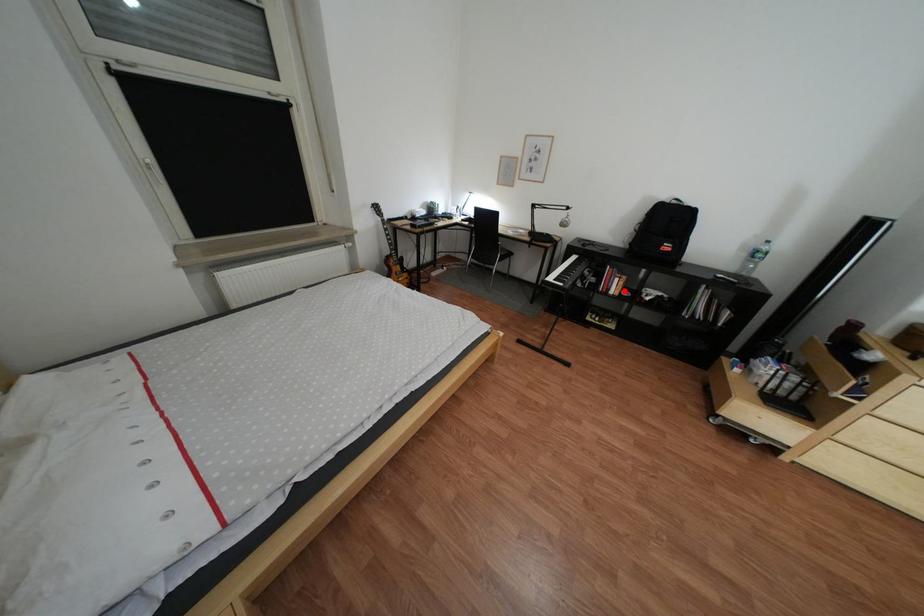
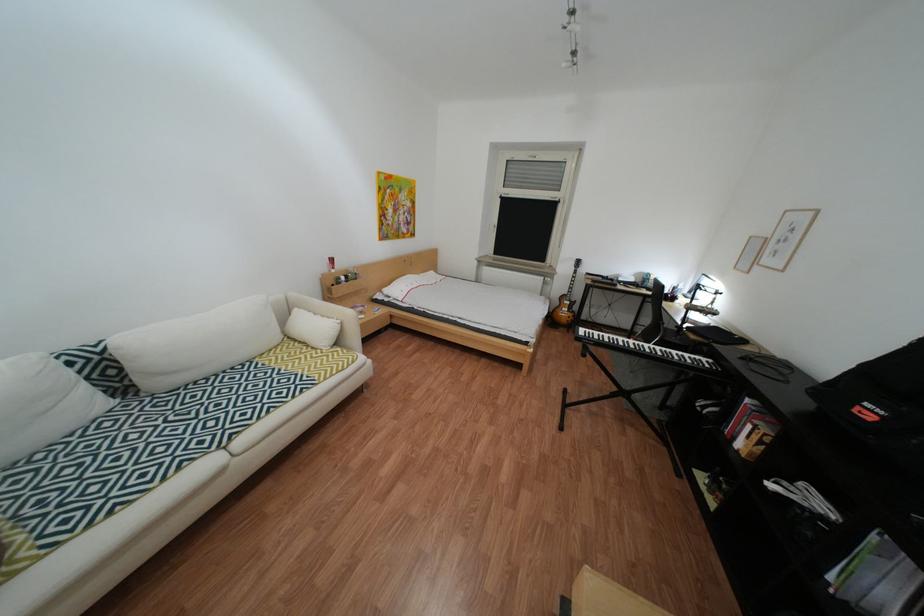
Question: I am providing you with two images of the same scene from different viewpoints. In image1, a red point is highlighted. Considering the same 3D point in image2, which of the following is correct?

Choices:
 (A) It is closer
 (B) It is farther

Answer: (B)